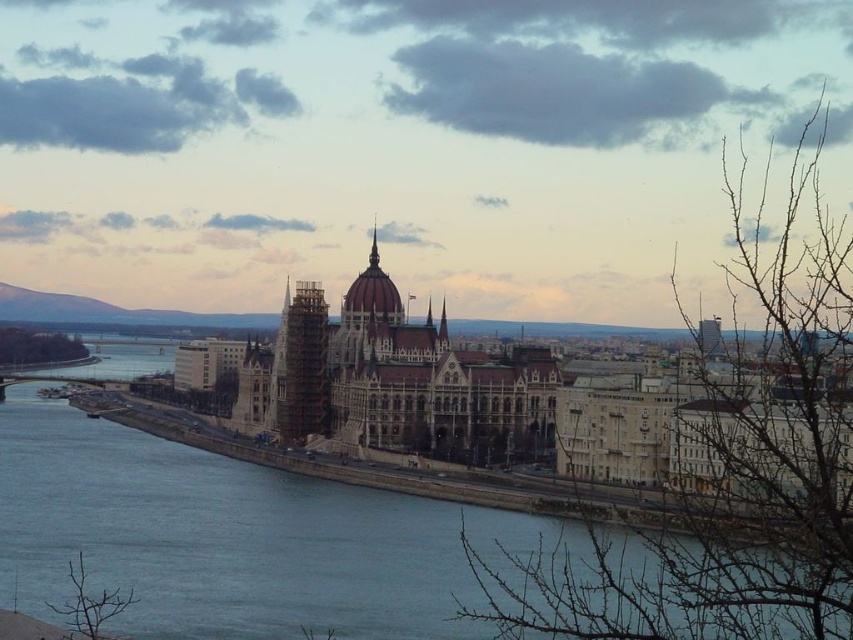
You are an architect inspecting the construction site of the Parliament Building. You notice the blue water at center and the wooden scaffolding at center. Which of these two objects has a greater height in the image?

The wooden scaffolding at center has a greater height than the blue water at center according to the description provided.

You are an architect examining the image of the historic building and the river. You need to determine the relative positions of the blue water at center and the wooden scaffolding at center. Which object is located to the left of the other?

The blue water at center is positioned on the left side of wooden scaffolding at center.